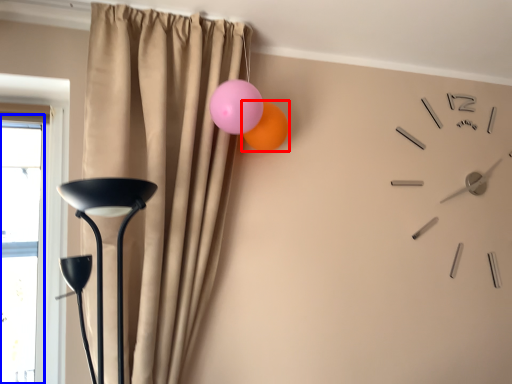
Question: Which of the following is the closest to the observer, balloon (highlighted by a red box) or window (highlighted by a blue box)?

Choices:
 (A) balloon
 (B) window

Answer: (B)